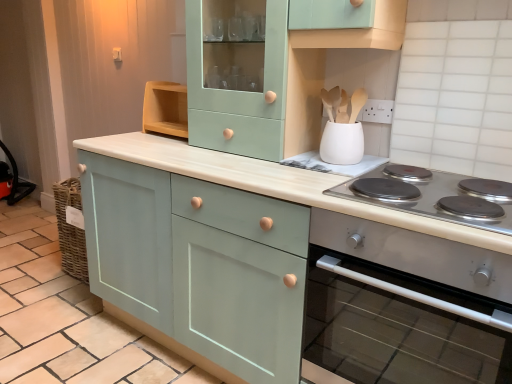
This screenshot has height=384, width=512. I want to click on vacant area to the right of white matte utensil holder at upper center, so click(386, 172).